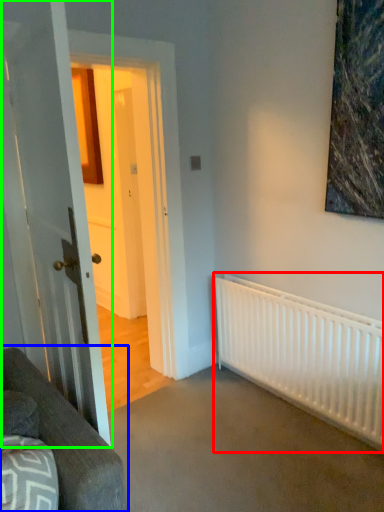
Question: Which is nearer to the radiator (highlighted by a red box)? studio couch (highlighted by a blue box) or door (highlighted by a green box).

Choices:
 (A) studio couch
 (B) door

Answer: (B)